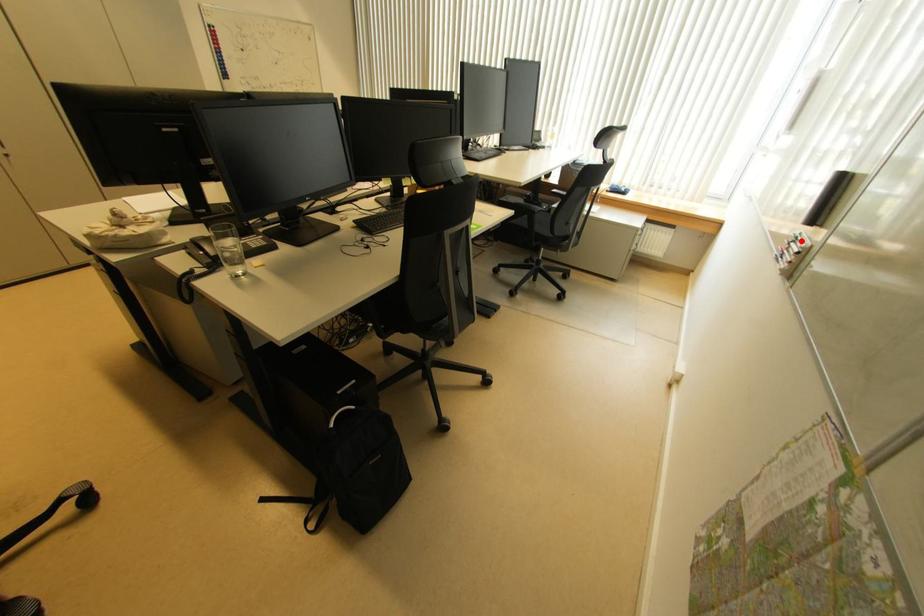
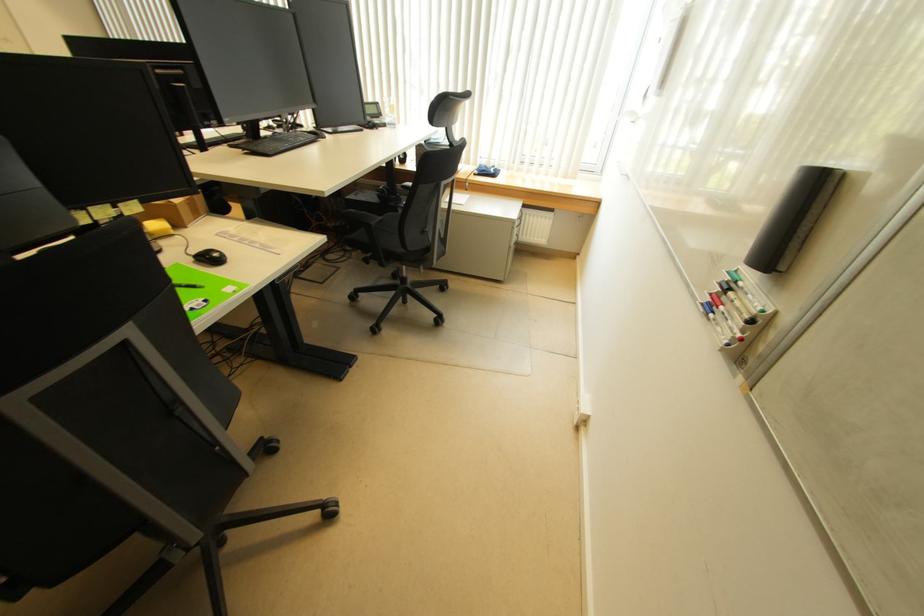
Question: I am providing you with two images of the same scene from different viewpoints. A red point is shown in image1. For the corresponding object point in image2, is it positioned nearer or farther from the camera?

Choices:
 (A) Nearer
 (B) Farther

Answer: (B)